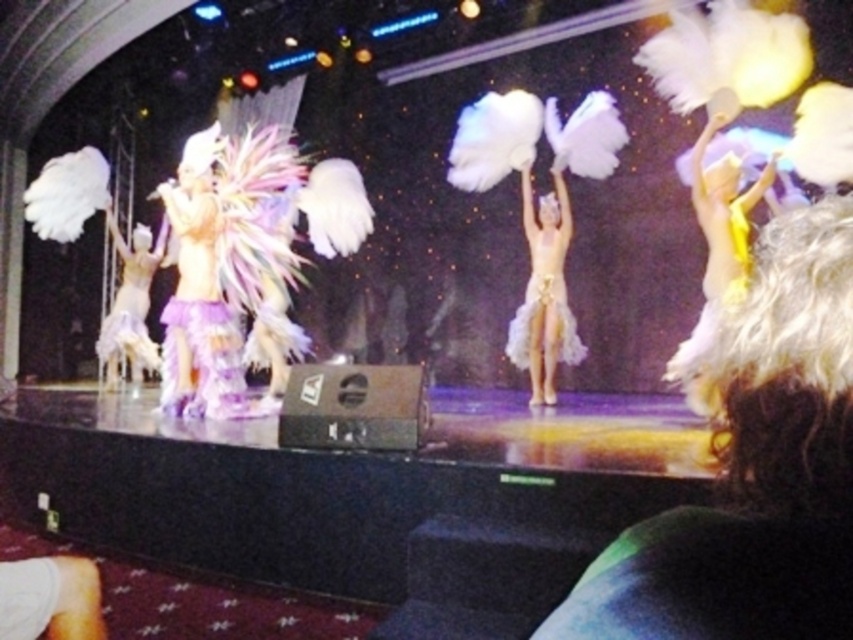
You are a photographer at the back of the stage. You need to capture a photo of the white feathered costume at center and the white feathered costume at left. Which one is positioned more to the right side of the stage?

The white feathered costume at center is positioned more to the right side of the stage compared to the white feathered costume at left.

You are a photographer at the back of the stage. You want to take a photo of both the white feathered costume at center and the white feathered costume at left. Which costume might block the view of the other when you aim your camera?

The white feathered costume at center is much taller than the white feathered costume at left, so it might block the view of the white feathered costume at left when aiming the camera.